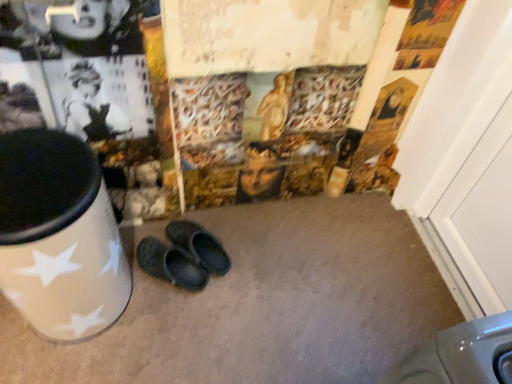
This screenshot has height=384, width=512. What do you see at coordinates (184, 256) in the screenshot?
I see `black rubber clogs at center` at bounding box center [184, 256].

Locate an element on the screen. Image resolution: width=512 pixels, height=384 pixels. white wood door at right is located at coordinates pos(466,160).

Does point (177, 221) lie in front of point (405, 128)?

No, (177, 221) is behind (405, 128).

Is black rubber clogs at center further to camera compared to white wood door at right?

Yes, black rubber clogs at center is further from the viewer.

From the image's perspective, is black rubber clogs at center on white wood door at right?

Actually, black rubber clogs at center appears below white wood door at right in the image.

Based on the photo, is black rubber clogs at center turned away from white wood door at right?

That's not correct — black rubber clogs at center is not looking away from white wood door at right.

Is black rubber clogs at center oriented towards white glossy waste container at left?

Yes, black rubber clogs at center faces towards white glossy waste container at left.

From the image's perspective, would you say black rubber clogs at center is positioned over white glossy waste container at left?

No, from the image's perspective, black rubber clogs at center is not above white glossy waste container at left.

From a real-world perspective, is black rubber clogs at center above or below white glossy waste container at left?

Clearly, from a real-world perspective, black rubber clogs at center is below white glossy waste container at left.

Is black rubber clogs at center smaller than white glossy waste container at left?

Correct, black rubber clogs at center occupies less space than white glossy waste container at left.

Can you tell me how much white glossy waste container at left and black rubber clogs at center differ in facing direction?

The angular difference between white glossy waste container at left and black rubber clogs at center is 34.3 degrees.

Is white glossy waste container at left shorter than black rubber clogs at center?

In fact, white glossy waste container at left may be taller than black rubber clogs at center.

Looking at this image, are white glossy waste container at left and black rubber clogs at center beside each other?

They are not placed beside each other.

From the picture: Considering the sizes of objects white glossy waste container at left and black rubber clogs at center in the image provided, who is smaller, white glossy waste container at left or black rubber clogs at center?

Smaller between the two is black rubber clogs at center.

From a real-world perspective, does white glossy waste container at left sit lower than white wood door at right?

Yes, from a real-world perspective, white glossy waste container at left is below white wood door at right.

From the image's perspective, is white glossy waste container at left below white wood door at right?

Yes, from the image's perspective, white glossy waste container at left is below white wood door at right.

In terms of height, does white glossy waste container at left look taller or shorter compared to white wood door at right?

Clearly, white glossy waste container at left is shorter compared to white wood door at right.

Are white glossy waste container at left and white wood door at right located far from each other?

Yes.

Can you confirm if white wood door at right is positioned to the left of black rubber clogs at center?

Incorrect, white wood door at right is not on the left side of black rubber clogs at center.

Do you think white wood door at right is within black rubber clogs at center, or outside of it?

white wood door at right exists outside the volume of black rubber clogs at center.

Locate an element on the screen. This screenshot has height=384, width=512. door on the right of black rubber clogs at center is located at coordinates (466, 160).

Which object is further away from the camera, white wood door at right or white glossy waste container at left?

white wood door at right.

Looking at this image, which object is positioned more to the right, white wood door at right or white glossy waste container at left?

white wood door at right.

From the image's perspective, is white wood door at right positioned above or below white glossy waste container at left?

From the image's perspective, white wood door at right appears above white glossy waste container at left.

Is white wood door at right next to white glossy waste container at left and touching it?

No.

I want to click on door on the right of black rubber clogs at center, so click(x=466, y=160).

Where is `waste container in front of the black rubber clogs at center`? The width and height of the screenshot is (512, 384). waste container in front of the black rubber clogs at center is located at coordinates (59, 236).

Based on their spatial positions, is black rubber clogs at center or white glossy waste container at left further from white wood door at right?

white glossy waste container at left lies further to white wood door at right than the other object.

Considering their positions, is white glossy waste container at left positioned further to white wood door at right than black rubber clogs at center?

Based on the image, white glossy waste container at left appears to be further to white wood door at right.

Considering their positions, is white wood door at right positioned closer to black rubber clogs at center than white glossy waste container at left?

white glossy waste container at left is closer to black rubber clogs at center.

Estimate the real-world distances between objects in this image. Which object is closer to white glossy waste container at left, black rubber clogs at center or white wood door at right?

Based on the image, black rubber clogs at center appears to be nearer to white glossy waste container at left.

Considering their positions, is white wood door at right positioned further to white glossy waste container at left than black rubber clogs at center?

white wood door at right.

Estimate the real-world distances between objects in this image. Which object is closer to black rubber clogs at center, white glossy waste container at left or white wood door at right?

Based on the image, white glossy waste container at left appears to be nearer to black rubber clogs at center.

At what (x,y) coordinates should I click in order to perform the action: click on footwear located between white glossy waste container at left and white wood door at right in the left-right direction. Please return your answer as a coordinate pair (x, y). Looking at the image, I should click on (184, 256).